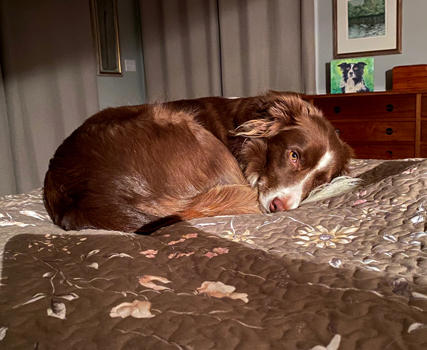
Find the location of a particular element. white fur is located at coordinates (x=293, y=192), (x=325, y=159).